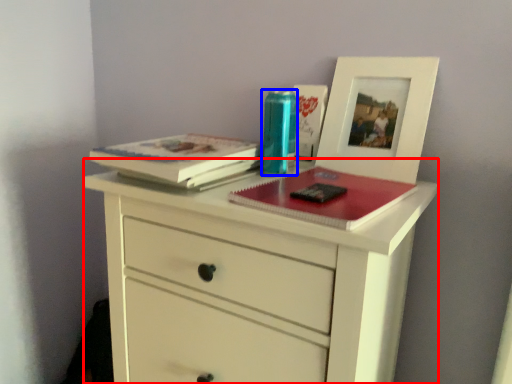
Question: Which of the following is the closest to the observer, chest of drawers (highlighted by a red box) or turquoise (highlighted by a blue box)?

Choices:
 (A) chest of drawers
 (B) turquoise

Answer: (A)